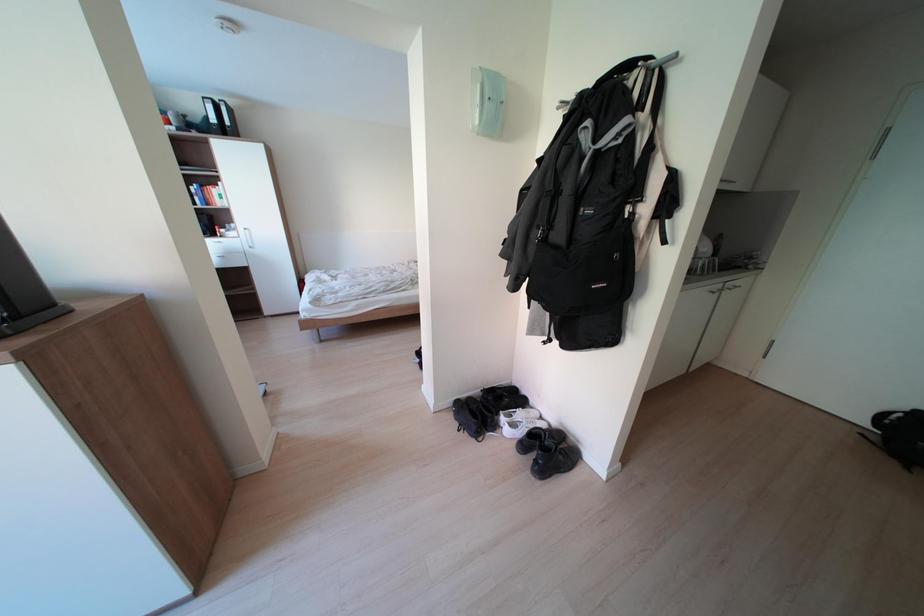
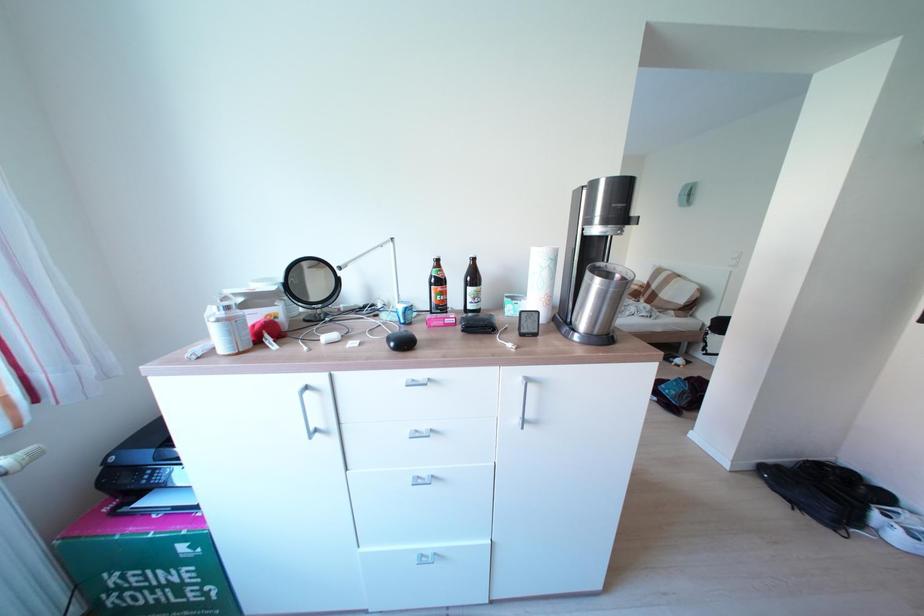
Question: Which direction would the cameraman need to move to produce the second image? Reply with the corresponding letter.

Choices:
 (A) Left
 (B) Right
 (C) Forward
 (D) Backward

Answer: (A)